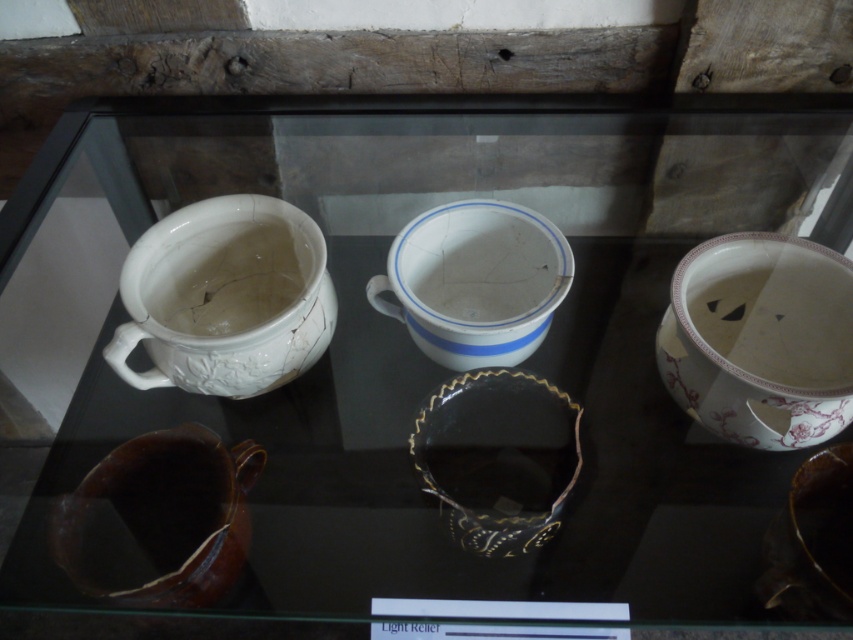
You are a museum curator arranging items on a display shelf. You have a white glossy mug at center and a black glossy bowl at center. You need to place a decorative plate between them. What is the minimum width the plate should be to fit snugly between the two items?

The white glossy mug at center and black glossy bowl at center are 4.67 inches apart from each other. To fit snugly between them, the decorative plate should be at least 4.67 inches wide.

You are a museum curator arranging an exhibit. You notice the brown glazed pitcher at lower left and the white matte teapot at upper left. Which object is placed higher in the display?

The white matte teapot at upper left is placed higher than the brown glazed pitcher at lower left.

You are a museum curator arranging items on a display shelf. You have a white glossy mug at upper left and a white matte teapot at upper left. If you want to place them side by side without overlapping, which item requires more horizontal space?

The white glossy mug at upper left requires more horizontal space because its width surpasses that of the white matte teapot at upper left.